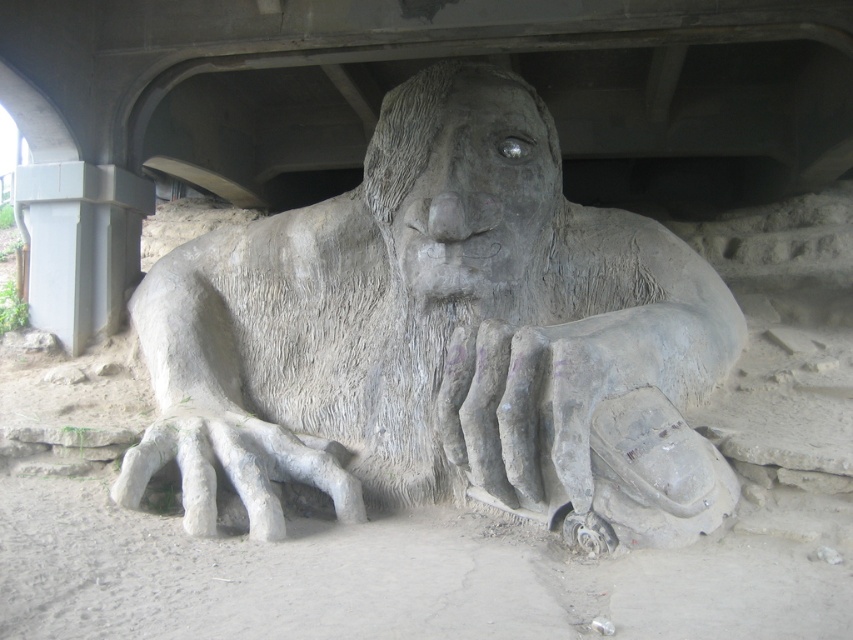
Question: Is gray stone statue at center wider than gray concrete pillar at left?

Choices:
 (A) yes
 (B) no

Answer: (A)

Question: Is gray stone statue at center positioned behind gray concrete pillar at left?

Choices:
 (A) yes
 (B) no

Answer: (B)

Question: Among these objects, which one is farthest from the camera?

Choices:
 (A) gray concrete pillar at left
 (B) gray stone statue at center

Answer: (A)

Question: Is gray stone statue at center bigger than gray concrete pillar at left?

Choices:
 (A) yes
 (B) no

Answer: (A)